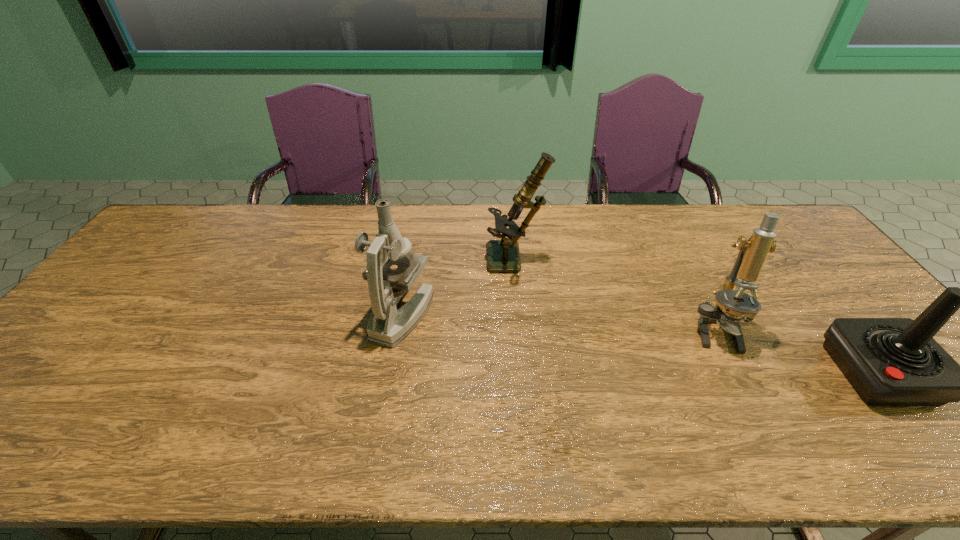
The image size is (960, 540). I want to click on free space at the far left corner, so click(x=162, y=227).

The image size is (960, 540). In the image, there is a desktop. What are the coordinates of `free space at the far right corner` in the screenshot? It's located at (766, 205).

Where is `free space between the second microscope from right to left and the rightmost microscope`? This screenshot has width=960, height=540. free space between the second microscope from right to left and the rightmost microscope is located at coordinates (615, 296).

Identify the location of free point between the leftmost microscope and the third object from right to left. The width and height of the screenshot is (960, 540). (459, 288).

I want to click on vacant area that lies between the rightmost microscope and the third object from right to left, so tap(615, 296).

Where is `vacant area between the leftmost object and the shortest object`? This screenshot has width=960, height=540. vacant area between the leftmost object and the shortest object is located at coordinates (641, 344).

Where is `free spot between the rightmost microscope and the leftmost microscope`? free spot between the rightmost microscope and the leftmost microscope is located at coordinates (559, 322).

Identify the location of free spot between the rightmost microscope and the shortest object. The height and width of the screenshot is (540, 960). (797, 352).

Find the location of `vacant space that's between the joystick and the second microscope from right to left`. vacant space that's between the joystick and the second microscope from right to left is located at coordinates tap(697, 318).

Where is `empty location between the third object from left to right and the second object from left to right`? empty location between the third object from left to right and the second object from left to right is located at coordinates (615, 296).